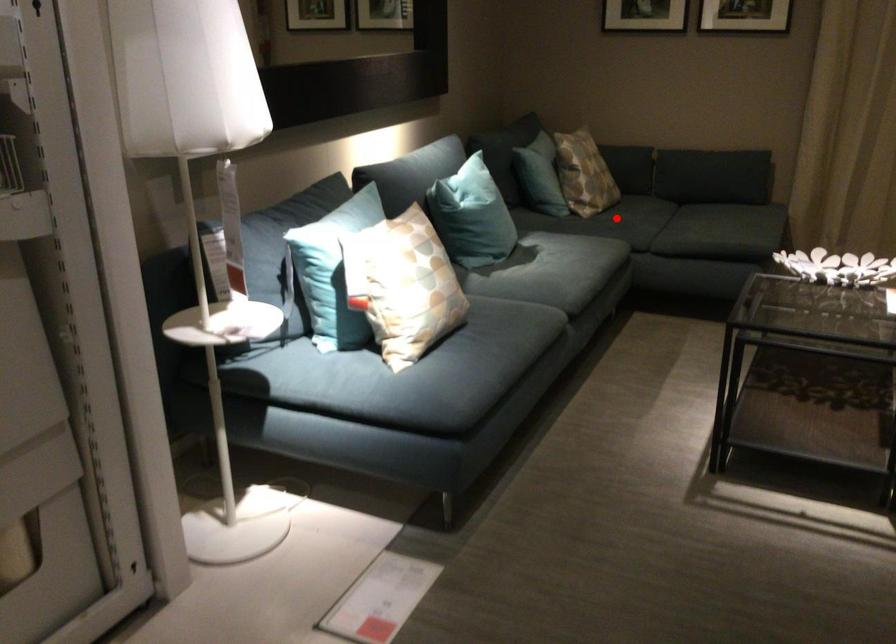
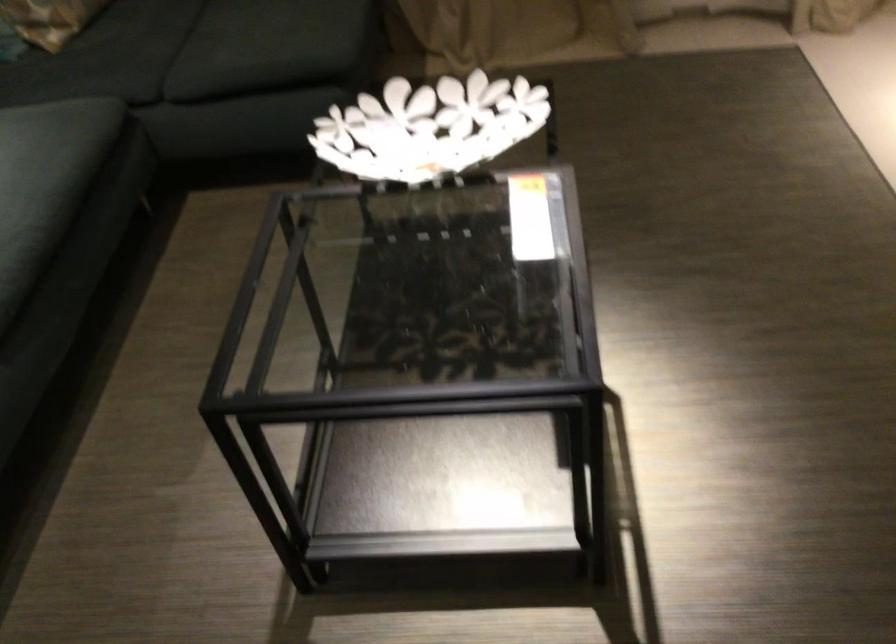
The point at the highlighted location is marked in the first image. Where is the corresponding point in the second image?

(85, 73)